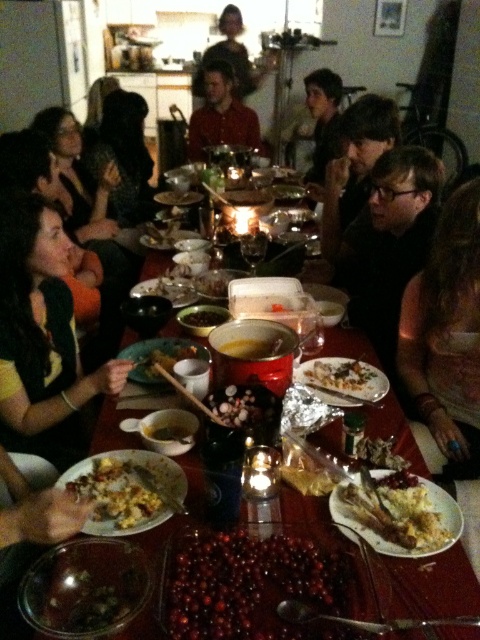
Question: Where is shiny dark glass bowl at center located in relation to blonde hair at upper center in the image?

Choices:
 (A) above
 (B) below

Answer: (B)

Question: Which object is positioned closest to the matte red shirt at center?

Choices:
 (A) dark brown hair at lower right
 (B) shiny metallic bowl at center
 (C) yellow matte bowl at center
 (D) crumbly yellow cake at center

Answer: (A)

Question: Which point is closer to the camera taking this photo?

Choices:
 (A) coord(56,573)
 (B) coord(119,474)

Answer: (A)

Question: Does shiny red grapes at center have a lesser width compared to yellow matte bowl at center?

Choices:
 (A) no
 (B) yes

Answer: (A)

Question: Is matte red shirt at center to the right of green matte bowl at center from the viewer's perspective?

Choices:
 (A) yes
 (B) no

Answer: (A)

Question: Which of the following is the farthest from the observer?

Choices:
 (A) (153, 433)
 (B) (470, 429)
 (C) (388, 236)
 (D) (72, 445)

Answer: (C)